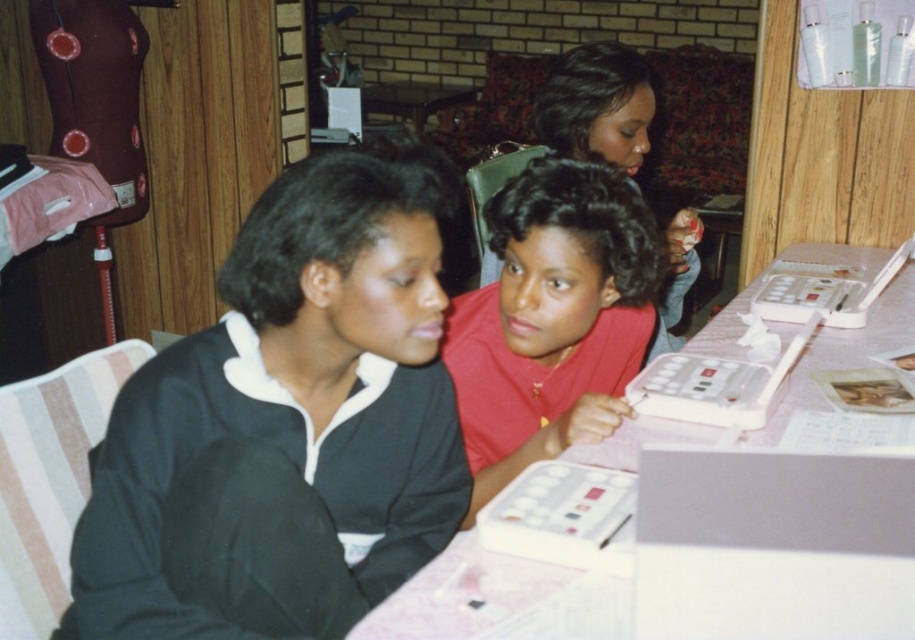
You are a customer in the salon and want to place your phone on the matte red shirt at center or the pink plastic table at center. Which surface will allow your phone to have more space around it?

The pink plastic table at center has a greater width than the matte red shirt at center, so placing the phone there would provide more space around it.

You are a customer entering the salon and want to sit next to the person wearing the black matte jacket at left. Which direction should you choose relative to the matte pink shirt at center?

The black matte jacket at left is positioned under the matte pink shirt at center, so to sit next to the black matte jacket at left, you should choose the direction below the matte pink shirt at center.

You are standing in front of the salon table and want to place a small vase between the black matte jacket at left and the pink plastic table at center. Which object should the vase be placed closer to if you want it to appear closer to the viewer?

The vase should be placed closer to the black matte jacket at left because it is already closer to the viewer than the pink plastic table at center.